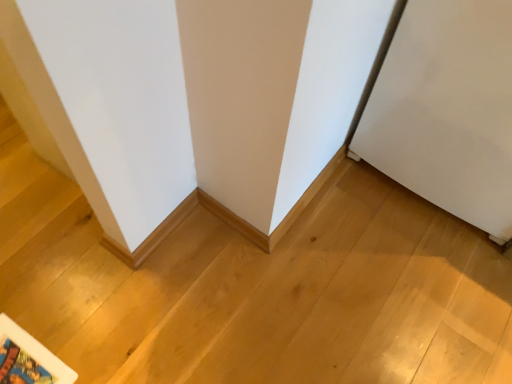
Identify the location of white matte refrigerator at lower right. The height and width of the screenshot is (384, 512). (447, 110).

Describe the element at coordinates (447, 110) in the screenshot. This screenshot has width=512, height=384. I see `white matte refrigerator at lower right` at that location.

In order to click on white matte refrigerator at lower right in this screenshot , I will do `click(447, 110)`.